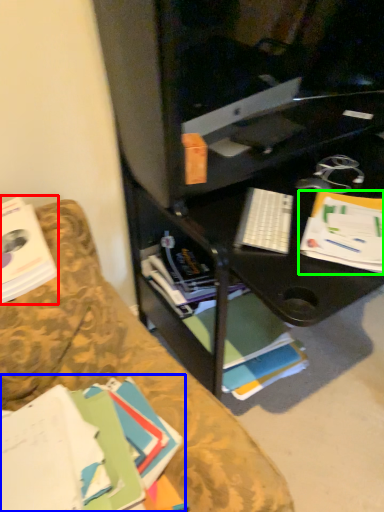
Question: Based on their relative distances, which object is farther from book (highlighted by a red box)? Choose from book (highlighted by a blue box) and paperback book (highlighted by a green box).

Choices:
 (A) book
 (B) paperback book

Answer: (B)